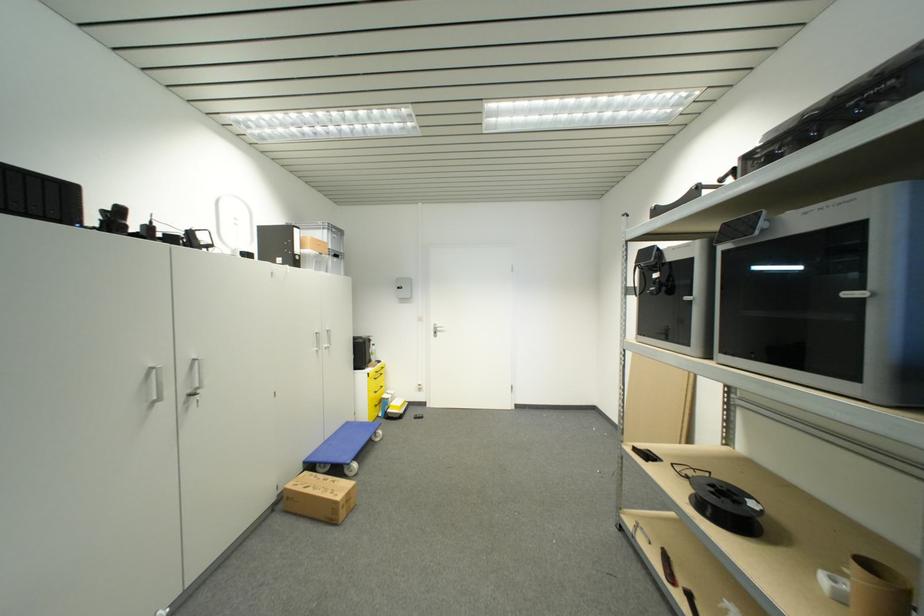
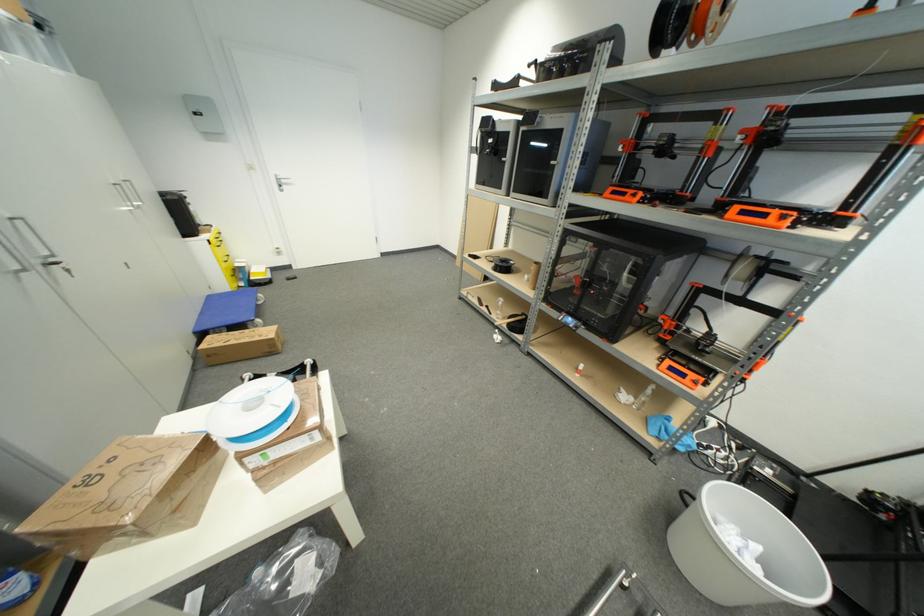
Find the pixel in the second image that matches [193,394] in the first image.

(43, 264)